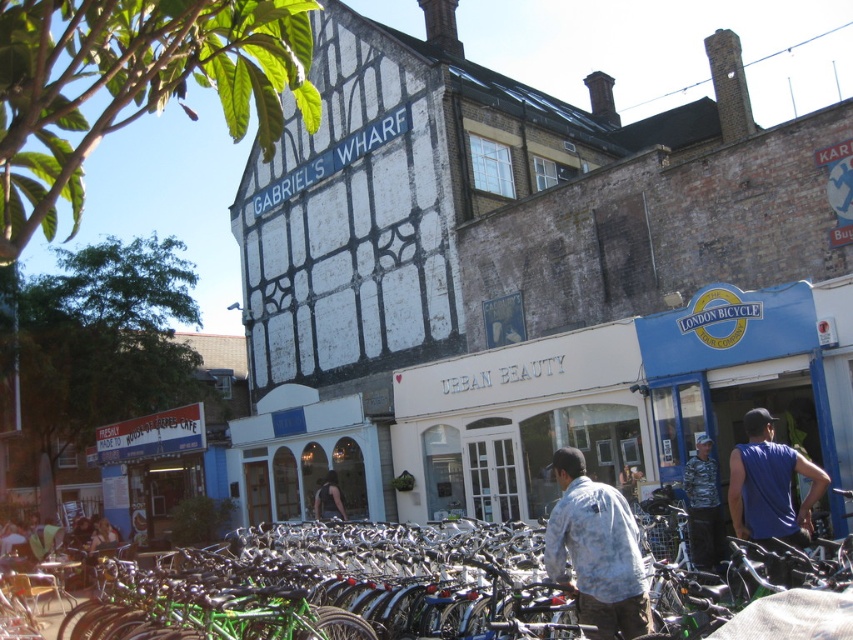
What is the position of the shiny metallic bicycle at center relative to the white matte building at center?

The shiny metallic bicycle at center is to the right of the white matte building at center.